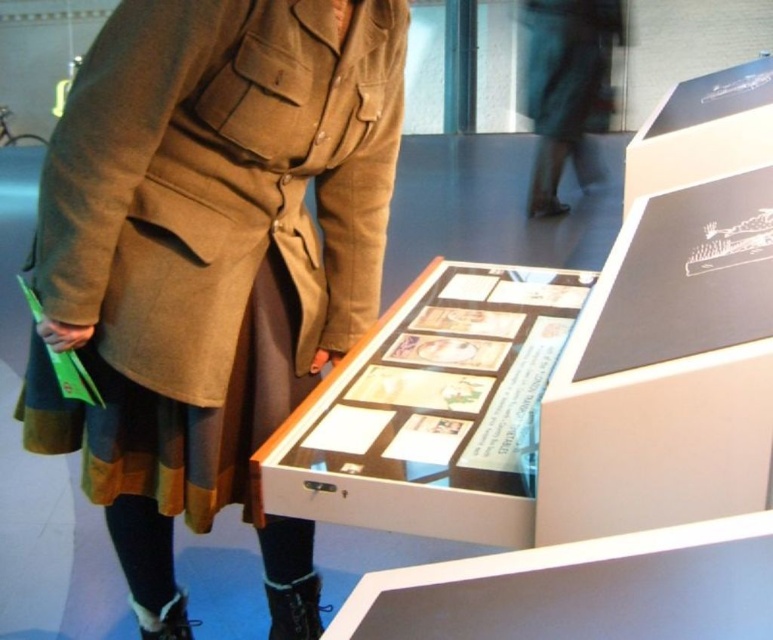
You are an assistant at the exhibition and need to determine which coat is smaller. You see the khaki woolen coat at center and the dark green fabric coat at upper center. Which one is smaller?

The khaki woolen coat at center is smaller compared to the dark green fabric coat at upper center.

You are an interior designer planning to install a 3.5 meter long decorative banner between the khaki woolen coat at center and the dark green fabric coat at upper center. Can the banner fit between them without overlapping either coat?

The distance between the khaki woolen coat at center and the dark green fabric coat at upper center is 3.47 meters, which is slightly shorter than the 3.5 meter banner. Therefore, the banner cannot fit between them without overlapping either coat.

You are standing in the exhibition space and want to determine which of the two points, point (315, 330) or point (576, 1), is closer to you. Based on the scene description, which point is nearer?

Point (315, 330) is closer to the viewer than point (576, 1).